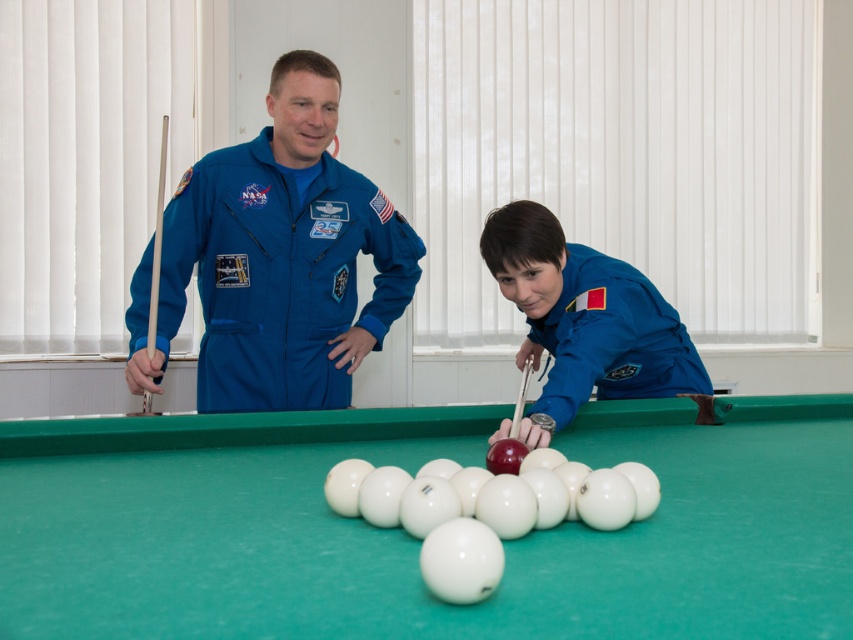
Does green felt billiard table at center have a greater height compared to blue fabric astronaut at center?

No, green felt billiard table at center is not taller than blue fabric astronaut at center.

Is point (219, 509) closer to camera compared to point (526, 216)?

Yes, point (219, 509) is closer to viewer.

I want to click on green felt billiard table at center, so click(418, 540).

Between blue fabric astronaut at center and matte wood cue at center, which one has less height?

With less height is matte wood cue at center.

This screenshot has height=640, width=853. What do you see at coordinates (584, 320) in the screenshot? I see `blue fabric astronaut at center` at bounding box center [584, 320].

Is point (560, 368) positioned after point (521, 385)?

No.

Identify the location of blue fabric astronaut at center. The height and width of the screenshot is (640, 853). (584, 320).

Locate an element on the screen. green felt billiard table at center is located at coordinates (418, 540).

Looking at this image, which of these two, green felt billiard table at center or wooden at left, stands taller?

With more height is wooden at left.

Is point (764, 540) positioned before point (154, 241)?

That is True.

Locate an element on the screen. The height and width of the screenshot is (640, 853). green felt billiard table at center is located at coordinates (418, 540).